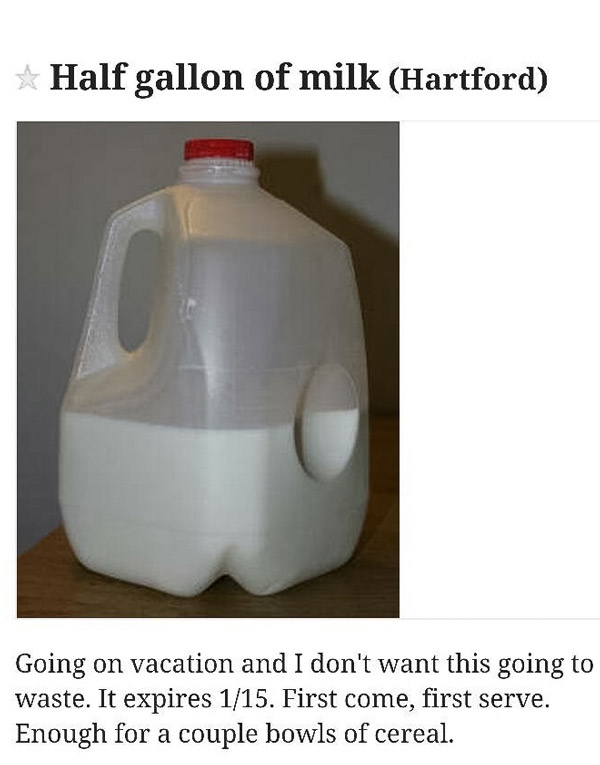
Where is `1 wooden surface`? The height and width of the screenshot is (765, 600). 1 wooden surface is located at coordinates 368,587.